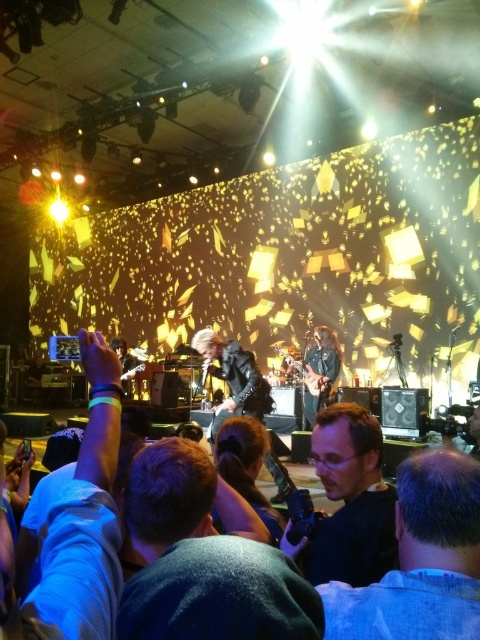
You are a photographer at the concert and want to capture both the dark blue denim jacket at lower center and the leather jacket at center in a single frame. Given that your camera has a limited zoom range, which jacket should you focus on to ensure both are visible?

The dark blue denim jacket at lower center is smaller than the leather jacket at center. To ensure both are visible in the frame, focus on the leather jacket at center since it is larger and will remain in the frame even if the camera zooms out slightly to include the smaller dark blue denim jacket at lower center.

You are a photographer at the concert and want to take a photo that includes both point (129, 532) and point (446, 628). Based on their positions, which point should be placed closer to the front of the image?

Point (129, 532) should be placed closer to the front of the image because it is further to the viewer than point (446, 628).

You are standing at the front of the concert venue and want to reach a specific point on the stage marked as point (117,556). If you can move forward 36 inches, will you be able to reach that point?

The distance of point (117,556) from viewer is 36.64 inches. Since you can move forward 36 inches, you will not be able to reach the point as it is slightly farther than your movement capability.